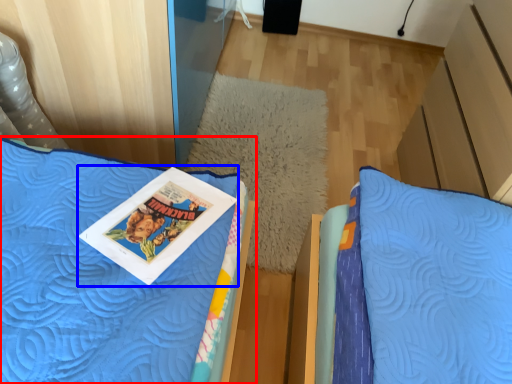
Question: Which object appears closest to the camera in this image, bed (highlighted by a red box) or comic book (highlighted by a blue box)?

Choices:
 (A) bed
 (B) comic book

Answer: (A)